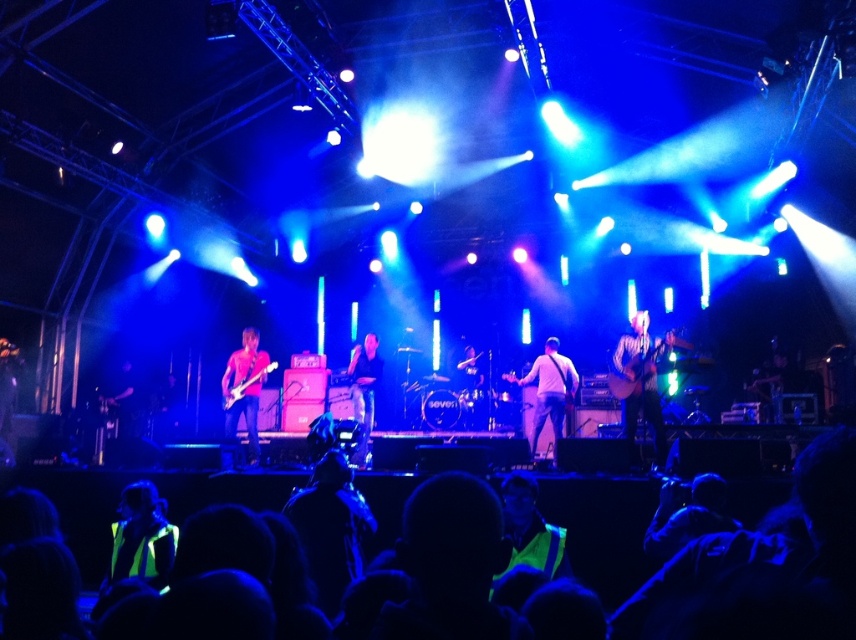
In the scene shown: You are a photographer at the event and want to capture a photo that includes both the neon yellow safety vest at lower left and the shiny silver guitar at right. Considering their sizes, which object will appear smaller in the photo?

The neon yellow safety vest at lower left will appear smaller in the photo because it is not as tall as the shiny silver guitar at right.

You are a stagehand who needs to place a 1.2 meter wide amplifier between the light brown leather guitar at center and the matte black guitar at center. Can the amplifier fit between them?

The light brown leather guitar at center is wider than the matte black guitar at center, so the total width of both guitars combined may exceed the amplifier width. However, the description only provides their individual widths relative to each other, not their exact measurements. Without knowing the exact widths of the guitars, it is impossible to determine if the 1.2 meter amplifier can fit between them.